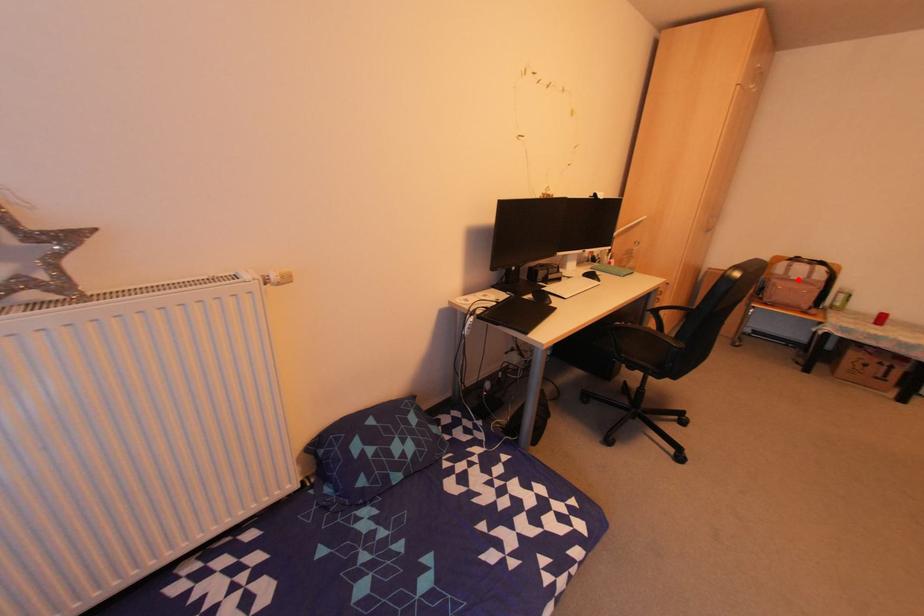
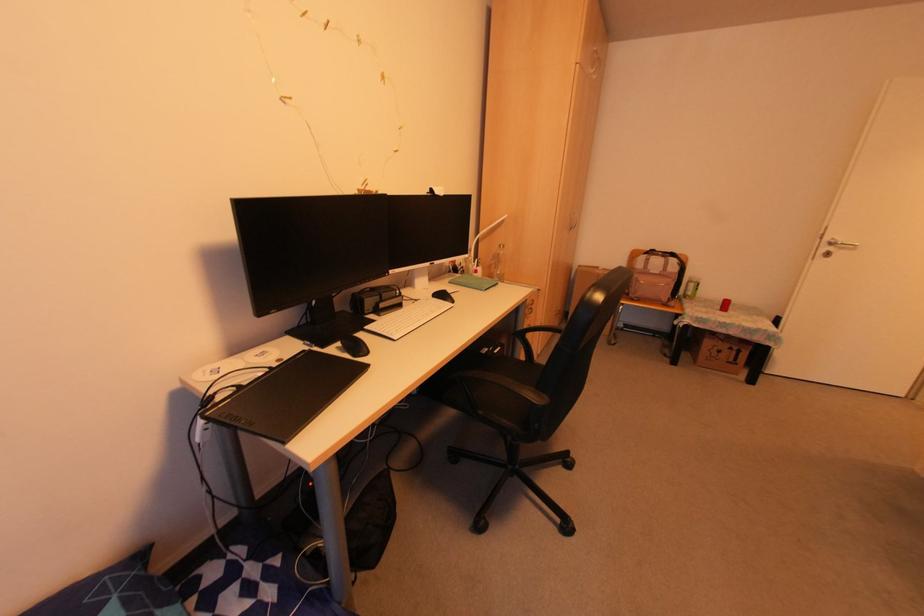
Question: A red point is marked in image1. In image2, is the corresponding 3D point closer to the camera or farther? Reply with the corresponding letter.

Choices:
 (A) The corresponding 3D point is closer.
 (B) The corresponding 3D point is farther.

Answer: (A)